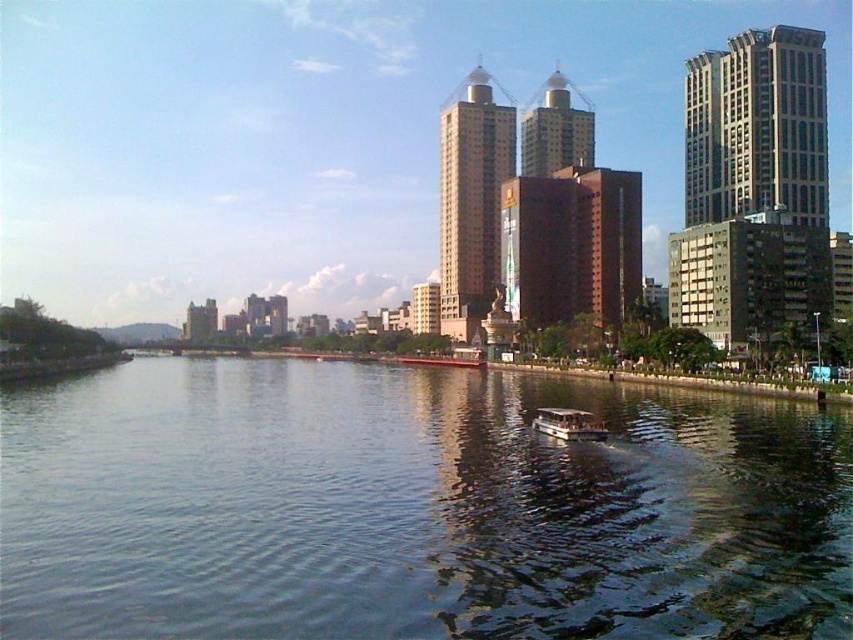
You are planning to dock a new boat that is 3 meters wide at the riverside. Looking at the image, can the green reflective water at center accommodate the boat if the boat is as wide as the metallic silver boat at center?

The green reflective water at center is wider than the metallic silver boat at center, so yes, the boat that is as wide as the metallic silver boat at center can be accommodated by the green reflective water at center.